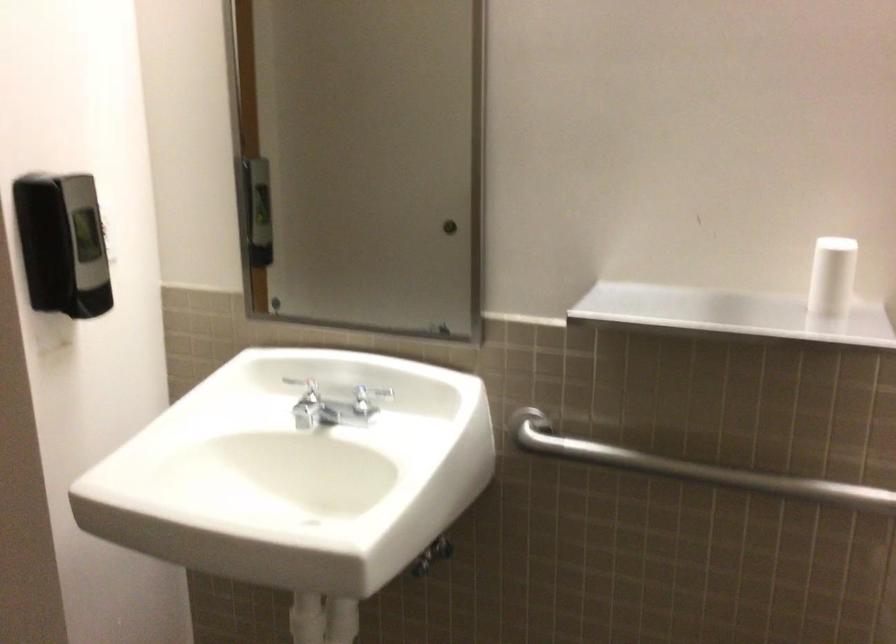
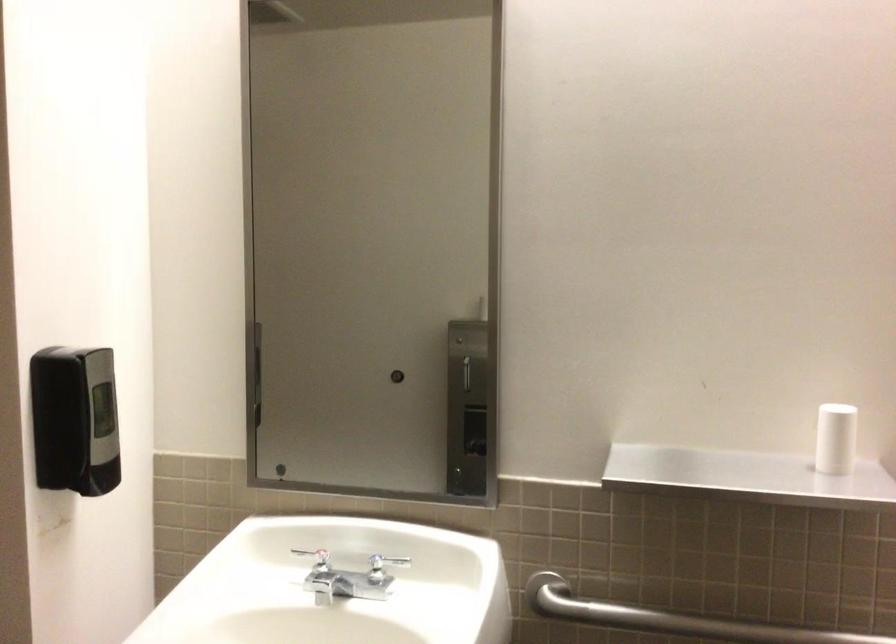
Question: What movement of the cameraman would produce the second image?

Choices:
 (A) Left
 (B) Right
 (C) Forward
 (D) Backward

Answer: (A)